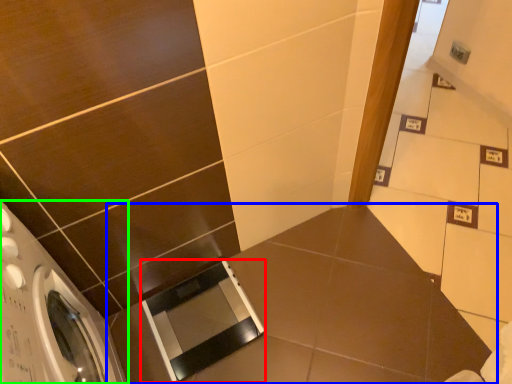
Question: Which object is the farthest from screen door (highlighted by a red box)? Choose among these: counter top (highlighted by a blue box) or washing machine (highlighted by a green box).

Choices:
 (A) counter top
 (B) washing machine

Answer: (B)